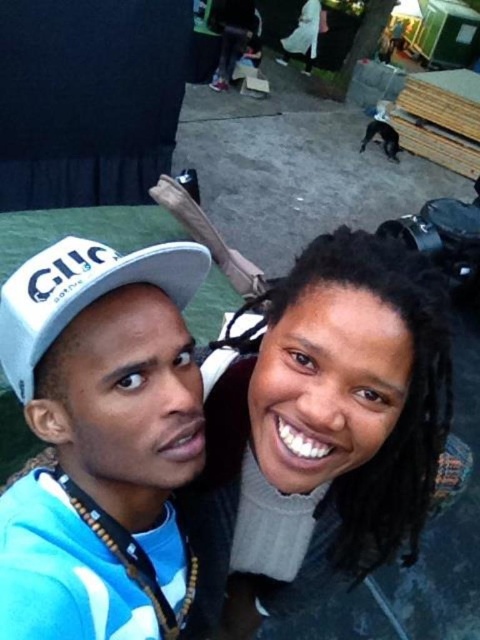
You are a photographer adjusting your camera settings to capture the perfect shot. The smooth gray sweater at center and the white matte baseball cap at upper left are two focal points in your frame. Given that the minimum focus distance of your lens is 16 inches, will you need to adjust your position to ensure both are in focus?

The smooth gray sweater at center and the white matte baseball cap at upper left are 15.70 inches apart from each other. Since the distance between them is less than the minimum focus distance of 16 inches, you will need to move closer to ensure both are in focus.

What is the exact coordinate of the white matte cap at upper left in the image?

The white matte cap at upper left is located at point (100,440).

Consider the image. You are a photographer trying to capture a closeup shot of both the smooth gray sweater at center and the white matte cap at upper left. Given that your camera has a 5 inch depth of field, will you be able to focus on both subjects simultaneously?

The distance between the smooth gray sweater at center and the white matte cap at upper left is 7.86 inches. Since the camera has a 5 inch depth of field, which is shorter than the distance between them, you cannot focus on both subjects simultaneously.